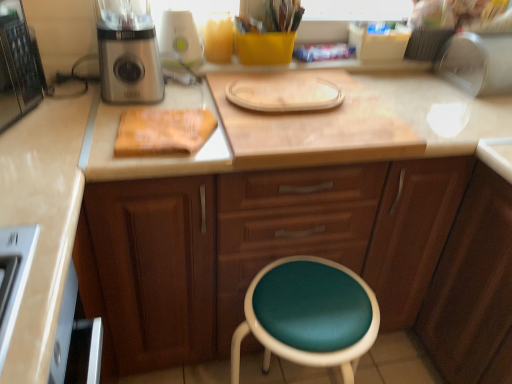
Question: Should I look upward or downward to see wooden cabinet at center?

Choices:
 (A) down
 (B) up

Answer: (A)

Question: From a real-world perspective, is metallic silver appliance at upper right, the second appliance positioned from the left, physically below wooden cutting board at center?

Choices:
 (A) no
 (B) yes

Answer: (A)

Question: Can you confirm if metallic silver appliance at upper right, acting as the first appliance starting from the right, is positioned to the left of wooden cutting board at center?

Choices:
 (A) no
 (B) yes

Answer: (A)

Question: Does metallic silver appliance at upper right, the second appliance positioned from the left, have a lesser height compared to wooden cutting board at center?

Choices:
 (A) yes
 (B) no

Answer: (B)

Question: From a real-world perspective, is metallic silver appliance at upper right, the second appliance positioned from the left, located higher than wooden cutting board at center?

Choices:
 (A) yes
 (B) no

Answer: (A)

Question: From the image's perspective, would you say metallic silver appliance at upper right, acting as the first appliance starting from the right, is positioned over wooden cutting board at center?

Choices:
 (A) yes
 (B) no

Answer: (A)

Question: Is metallic silver appliance at upper right, the second appliance positioned from the left, at the right side of wooden cutting board at center?

Choices:
 (A) no
 (B) yes

Answer: (B)

Question: Does metallic silver appliance at upper right, the second appliance positioned from the left, have a lesser height compared to white plastic blender at upper center, placed as the 1th appliance when sorted from left to right?

Choices:
 (A) no
 (B) yes

Answer: (B)

Question: Does metallic silver appliance at upper right, acting as the first appliance starting from the right, have a larger size compared to white plastic blender at upper center, positioned as the 2th appliance in right-to-left order?

Choices:
 (A) yes
 (B) no

Answer: (A)

Question: Is metallic silver appliance at upper right, the second appliance positioned from the left, beside white plastic blender at upper center, placed as the 1th appliance when sorted from left to right?

Choices:
 (A) yes
 (B) no

Answer: (B)

Question: Can you confirm if metallic silver appliance at upper right, the second appliance positioned from the left, is positioned to the right of white plastic blender at upper center, placed as the 1th appliance when sorted from left to right?

Choices:
 (A) no
 (B) yes

Answer: (B)

Question: Is metallic silver appliance at upper right, acting as the first appliance starting from the right, further to camera compared to white plastic blender at upper center, positioned as the 2th appliance in right-to-left order?

Choices:
 (A) no
 (B) yes

Answer: (B)

Question: Can we say metallic silver appliance at upper right, the second appliance positioned from the left, lies outside white plastic blender at upper center, positioned as the 2th appliance in right-to-left order?

Choices:
 (A) no
 (B) yes

Answer: (B)

Question: From the image's perspective, is wooden cutting board at center beneath white plastic blender at upper center, positioned as the 2th appliance in right-to-left order?

Choices:
 (A) yes
 (B) no

Answer: (A)